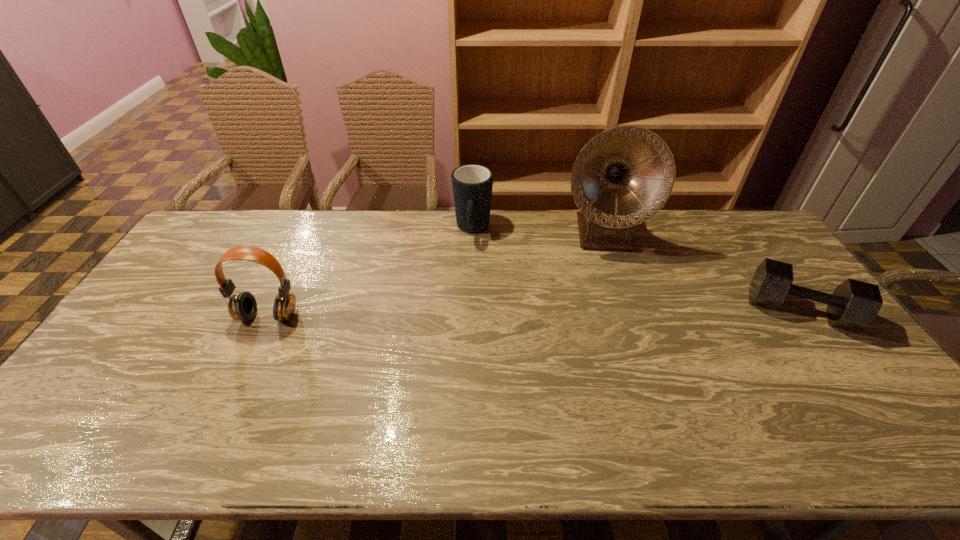
At what (x,y) coordinates should I click in order to perform the action: click on headset. Please return your answer as a coordinate pair (x, y). Looking at the image, I should click on (242, 306).

Identify the location of the rightmost object. (853, 306).

The width and height of the screenshot is (960, 540). I want to click on the shortest object, so click(x=853, y=306).

Locate an element on the screen. mug is located at coordinates (472, 184).

At what (x,y) coordinates should I click in order to perform the action: click on the third object from left to right. Please return your answer as a coordinate pair (x, y). The height and width of the screenshot is (540, 960). Looking at the image, I should click on (623, 176).

I want to click on the tallest object, so click(623, 176).

At what (x,y) coordinates should I click in order to perform the action: click on vacant region located 0.250m on the ear cups of the leftmost object. Please return your answer as a coordinate pair (x, y). Looking at the image, I should click on (226, 406).

Find the location of a particular element. This screenshot has width=960, height=540. vacant space situated on the left of the shortest object is located at coordinates point(622,310).

This screenshot has width=960, height=540. I want to click on free space located on the side of the third object from right to left with the handle, so click(x=467, y=298).

Where is `free spot located 0.060m on the side of the third object from right to left with the handle`? The height and width of the screenshot is (540, 960). free spot located 0.060m on the side of the third object from right to left with the handle is located at coordinates (470, 259).